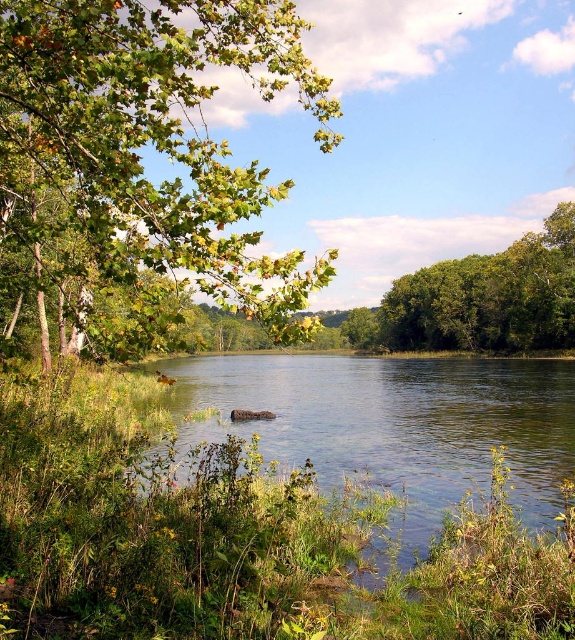
Question: Which of the following is the closest to the observer?

Choices:
 (A) (553, 394)
 (B) (534, 262)
 (C) (115, 232)

Answer: (C)

Question: Does green leafy branch at upper left appear under green grassy river at center?

Choices:
 (A) no
 (B) yes

Answer: (A)

Question: Is green grassy river at center below green leafy tree at right?

Choices:
 (A) yes
 (B) no

Answer: (A)

Question: Which point is closer to the camera taking this photo?

Choices:
 (A) (538, 525)
 (B) (78, 131)

Answer: (B)

Question: Considering the real-world distances, which object is closest to the green leafy branch at upper left?

Choices:
 (A) green grassy river at center
 (B) green leafy tree at right

Answer: (A)

Question: Can you confirm if green leafy branch at upper left is thinner than green leafy tree at right?

Choices:
 (A) no
 (B) yes

Answer: (A)